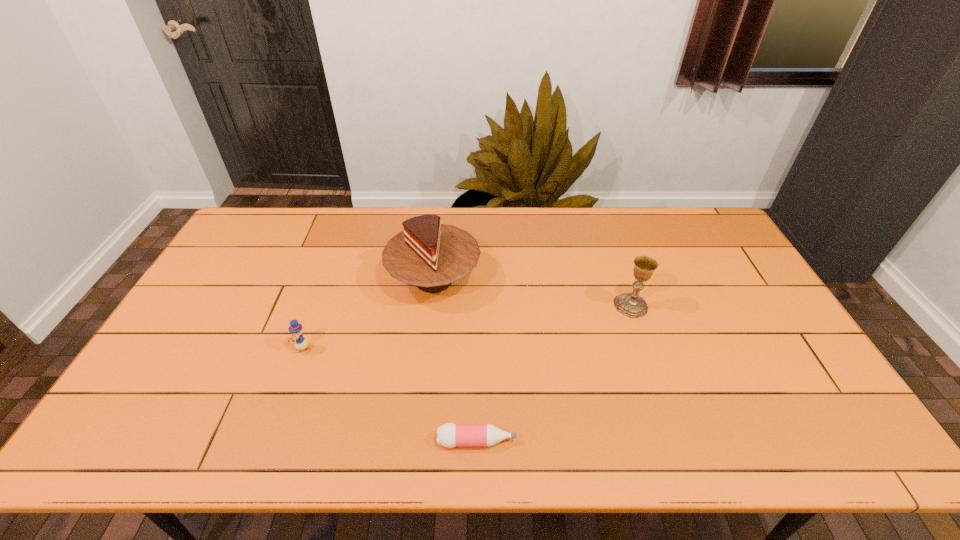
Identify the location of cake. (427, 254).

This screenshot has height=540, width=960. What are the coordinates of `the rightmost object` in the screenshot? It's located at (x=632, y=305).

Locate an element on the screen. This screenshot has height=540, width=960. the second nearest object is located at coordinates (301, 343).

Locate an element on the screen. duckling is located at coordinates (301, 343).

Locate an element on the screen. Image resolution: width=960 pixels, height=540 pixels. the shortest object is located at coordinates (449, 435).

Image resolution: width=960 pixels, height=540 pixels. In order to click on bottle in this screenshot , I will do `click(449, 435)`.

The image size is (960, 540). What are the coordinates of `vacant space located 0.080m on the left of the cake` in the screenshot? It's located at (362, 280).

Locate an element on the screen. This screenshot has width=960, height=540. vacant area situated 0.190m on the back of the rightmost object is located at coordinates (613, 254).

Where is `free spot located 0.220m on the face of the second nearest object, where the monocle is placed`? free spot located 0.220m on the face of the second nearest object, where the monocle is placed is located at coordinates (273, 431).

The image size is (960, 540). I want to click on vacant point located 0.280m with the cap open on the bottle, so click(x=637, y=441).